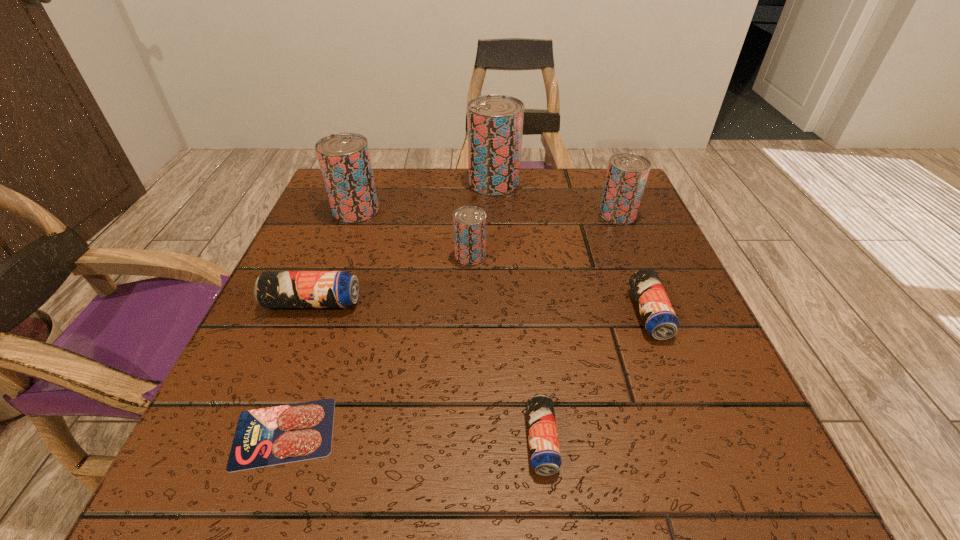
Identify the location of free spot located 0.230m on the front of the second biggest blue beer can. (715, 483).

Find the location of `vacant space situated 0.190m on the back of the seventh tallest object`. vacant space situated 0.190m on the back of the seventh tallest object is located at coordinates (528, 313).

Where is `vacant space located on the right of the shortest object`? vacant space located on the right of the shortest object is located at coordinates click(x=422, y=433).

Find the location of a particular element. The width and height of the screenshot is (960, 540). beer can that is at the near edge is located at coordinates (545, 456).

Identify the location of salami that is at the near edge. Image resolution: width=960 pixels, height=540 pixels. (x=269, y=436).

Image resolution: width=960 pixels, height=540 pixels. I want to click on salami present at the left edge, so click(269, 436).

I want to click on object at the far left corner, so click(344, 158).

Locate an element on the screen. The width and height of the screenshot is (960, 540). object positioned at the near left corner is located at coordinates (269, 436).

Locate an element on the screen. object present at the far right corner is located at coordinates (627, 173).

You are a GUI agent. You are given a task and a screenshot of the screen. Output one action in this format:
    pyautogui.click(x=<x>, y=<y>)
    Task: Click on the free space at the far edge
    
    Given the screenshot: What is the action you would take?
    pyautogui.click(x=507, y=202)